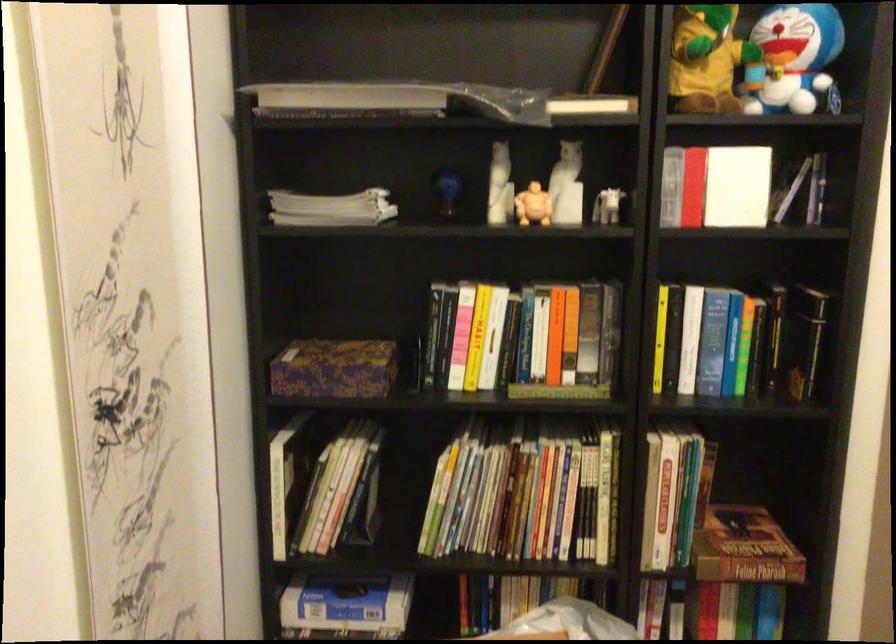
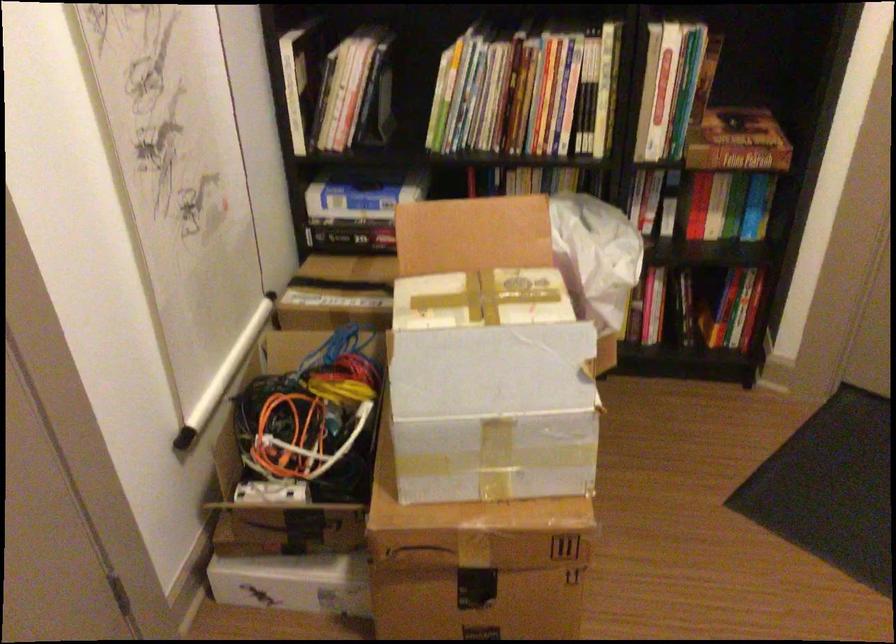
Where in the second image is the point corresponding to pixel 597 507 from the first image?

(595, 100)